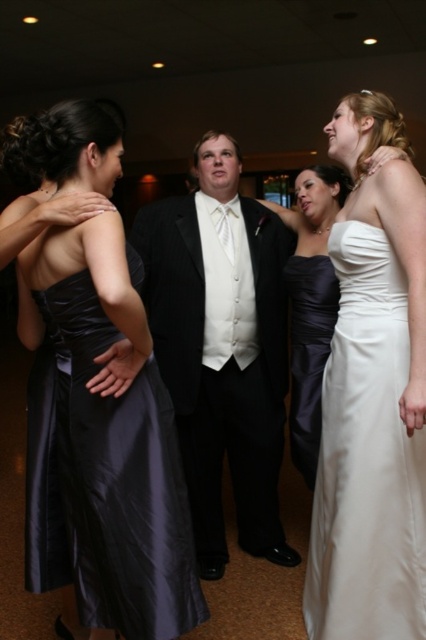
Who is shorter, white satin dress at right or satin dress at center?

satin dress at center

Between point (423, 433) and point (308, 416), which one is positioned behind?

Positioned behind is point (308, 416).

Where is `white satin dress at right`? white satin dress at right is located at coordinates (367, 458).

Is satin black dress at left positioned at the back of white satin dress at right?

No, satin black dress at left is closer to the viewer.

Is satin black dress at left thinner than white satin dress at right?

No.

Is point (157, 372) closer to viewer compared to point (328, 520)?

Yes, point (157, 372) is in front of point (328, 520).

Locate an element on the screen. satin black dress at left is located at coordinates (104, 481).

Who is more forward, (310, 256) or (316, 257)?

Point (316, 257) is more forward.

Is satin strapless dress at center above satin dress at center?

Yes.

Describe the element at coordinates (310, 304) in the screenshot. I see `satin strapless dress at center` at that location.

What are the coordinates of `satin strapless dress at center` in the screenshot? It's located at (310, 304).